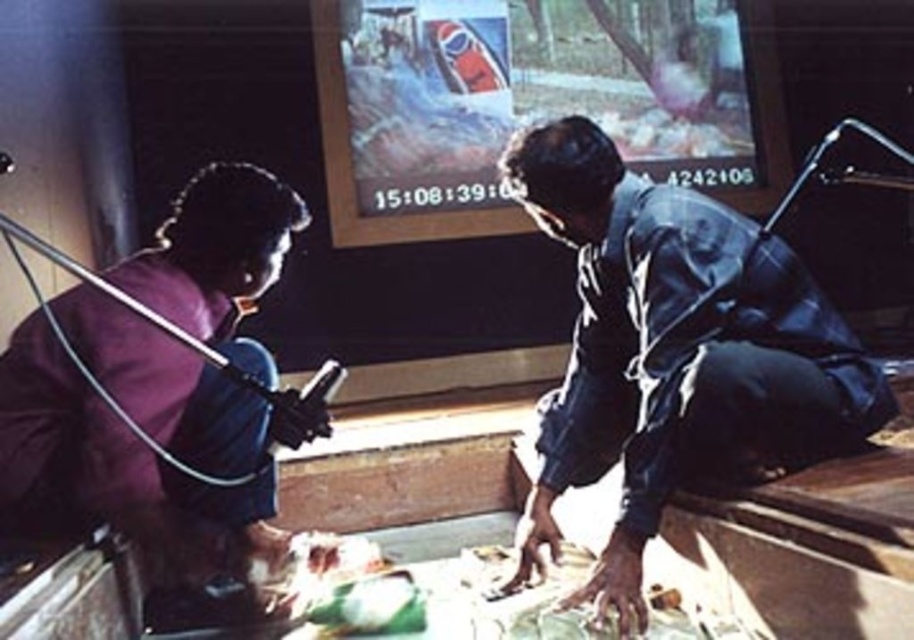
Based on the photo, who is more distant from viewer, (649, 330) or (226, 502)?

The point (226, 502) is behind.

Is point (548, 433) positioned before point (264, 403)?

That is False.

Image resolution: width=914 pixels, height=640 pixels. I want to click on dark blue fabric at right, so click(673, 353).